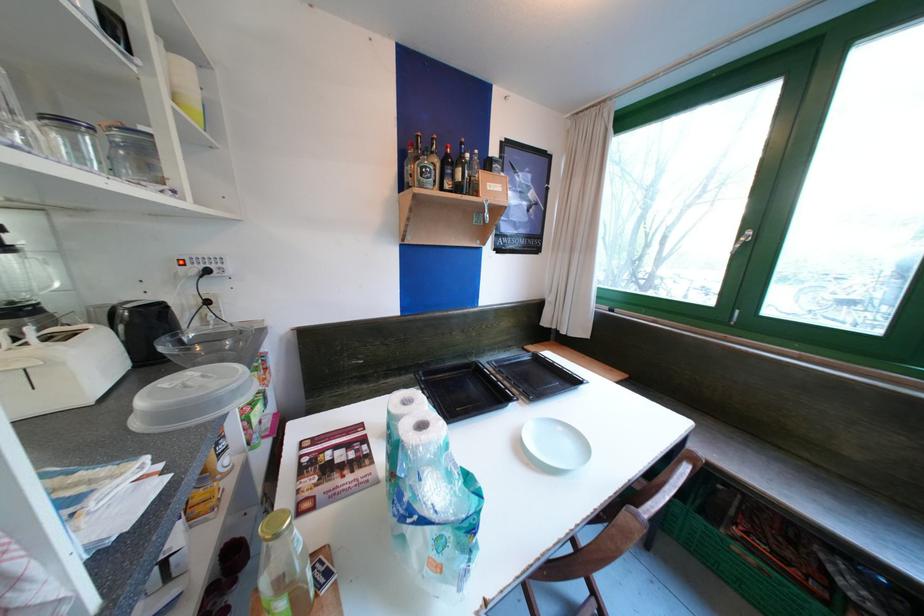
Find where to us the metal bottle opener. Please return your answer as a coordinate pair (x, y).

(602, 369)